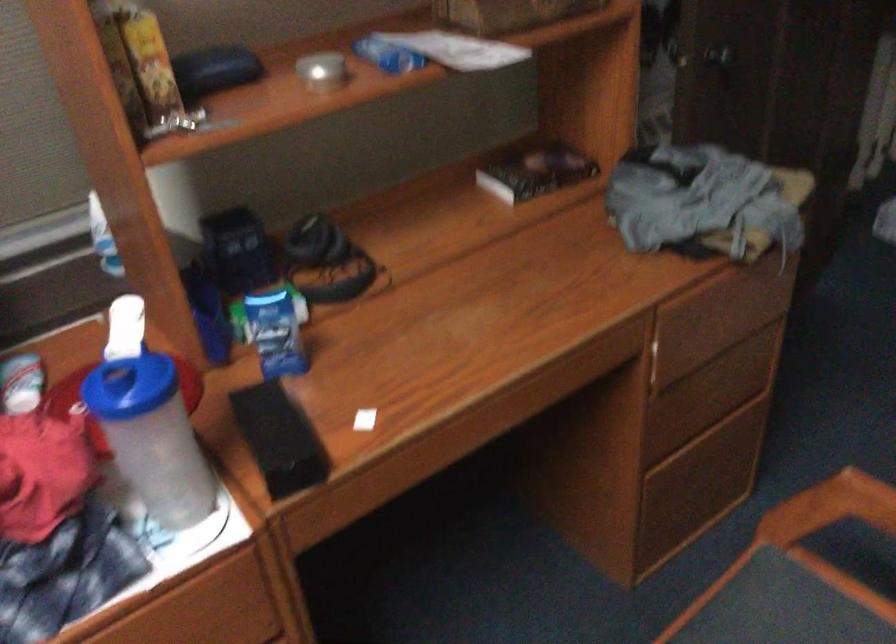
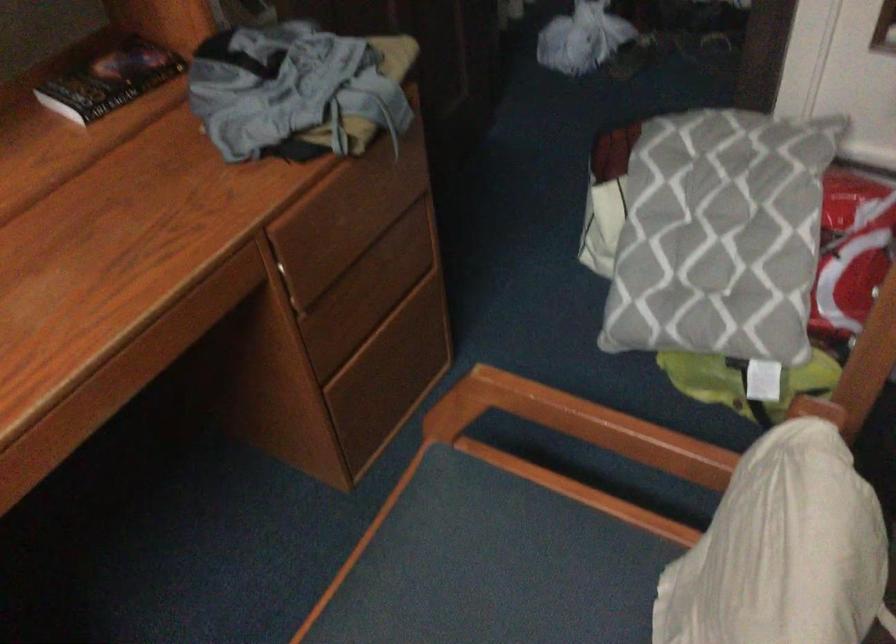
What movement of the cameraman would produce the second image?

The movement direction of the cameraman is right, forward.